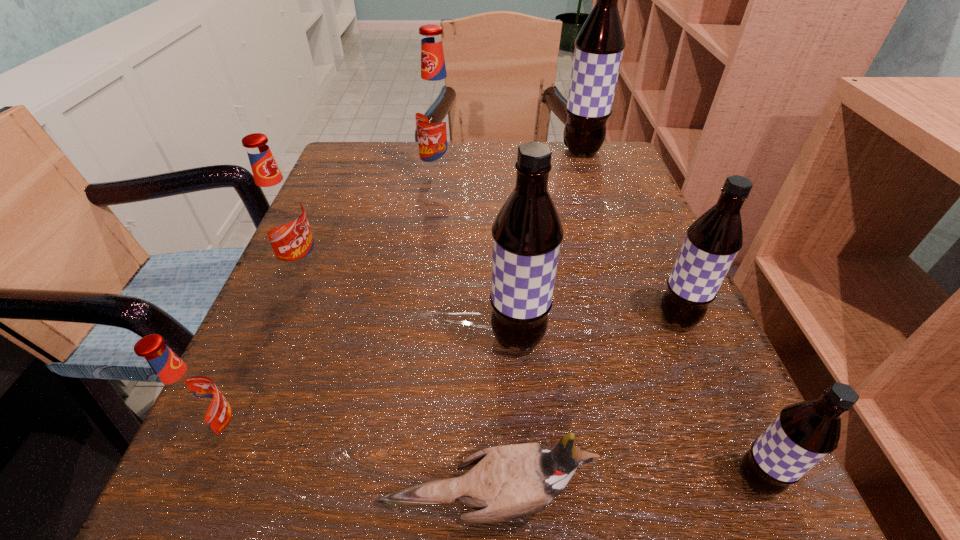
This screenshot has height=540, width=960. In order to click on vacant space at the far left corner of the desktop in this screenshot , I will do `click(376, 165)`.

In the image, there is a desktop. At what (x,y) coordinates should I click in order to perform the action: click on vacant space at the near left corner. Please return your answer as a coordinate pair (x, y). The height and width of the screenshot is (540, 960). Looking at the image, I should click on (285, 485).

Identify the location of vacant space at the far right corner of the desktop. The width and height of the screenshot is (960, 540). (605, 163).

The height and width of the screenshot is (540, 960). In the image, there is a desktop. What are the coordinates of `free region at the near right corner` in the screenshot? It's located at (683, 457).

Image resolution: width=960 pixels, height=540 pixels. Identify the location of vacant area between the nearest root beer and the second biggest red root beer. point(530,374).

I want to click on vacant space that is in between the third biggest brown root beer and the tallest root beer, so click(x=630, y=235).

This screenshot has width=960, height=540. I want to click on empty space between the third farthest root beer and the third nearest object, so click(x=262, y=352).

At what (x,y) coordinates should I click in order to perform the action: click on vacant space that's between the smallest brown root beer and the fifth root beer from right to left. Please return your answer as a coordinate pair (x, y). Looking at the image, I should click on (599, 329).

The image size is (960, 540). In order to click on vacant area that lies between the seventh nearest object and the bird in this screenshot , I will do `click(460, 342)`.

This screenshot has height=540, width=960. I want to click on free point between the farthest red root beer and the smallest brown root beer, so click(x=599, y=329).